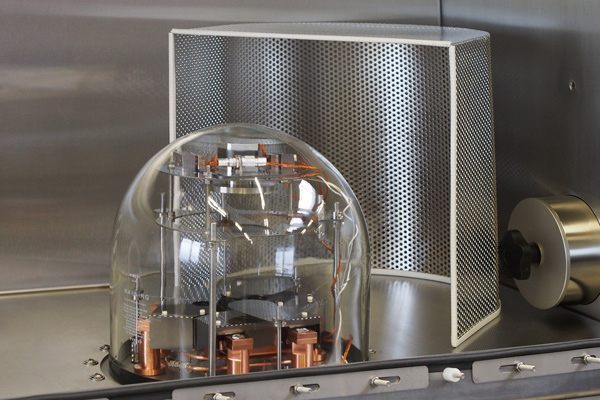
Identify the location of base of bell jar. Image resolution: width=600 pixels, height=400 pixels. (130, 377).